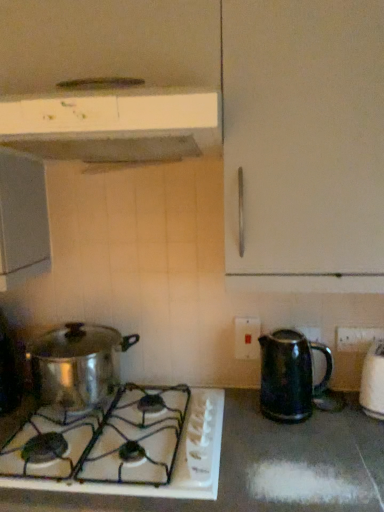
Find the location of a particular element. free spot in front of shiny metallic kettle at right, marked as the 3th kitchen appliance in a top-to-bottom arrangement is located at coordinates (302, 446).